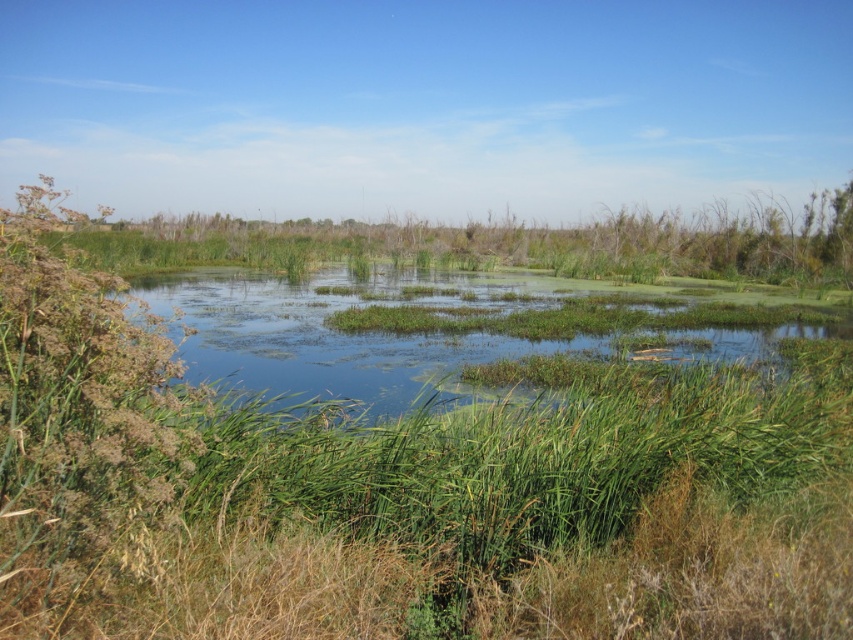
Question: Is green grassy wetland at center thinner than green grassy lake at center?

Choices:
 (A) no
 (B) yes

Answer: (B)

Question: In this image, where is green grassy wetland at center located relative to green grassy lake at center?

Choices:
 (A) below
 (B) above

Answer: (A)

Question: Is green grassy wetland at center behind green grassy lake at center?

Choices:
 (A) no
 (B) yes

Answer: (A)

Question: Which point is closer to the camera taking this photo?

Choices:
 (A) (392, 474)
 (B) (257, 339)

Answer: (A)